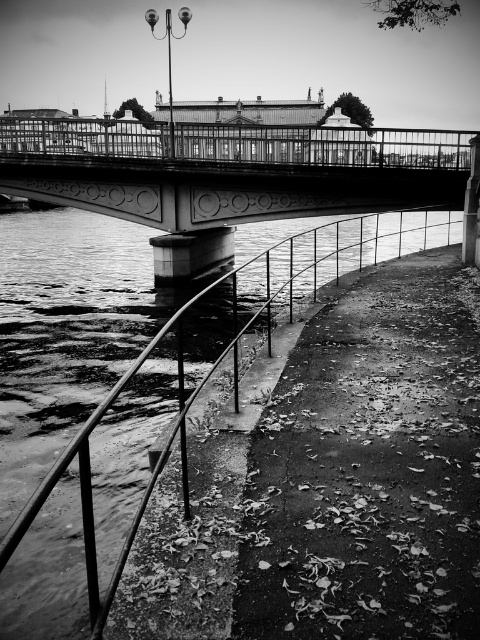
Is point (3, 289) more distant than point (74, 145)?

No, it is not.

Does metal/rusty rail at lower left come behind metallic bridge at center?

No, metal/rusty rail at lower left is closer to the viewer.

Which is behind, point (128, 449) or point (194, 177)?

Positioned behind is point (194, 177).

Image resolution: width=480 pixels, height=640 pixels. What are the coordinates of `metal/rusty rail at lower left` in the screenshot? It's located at (63, 333).